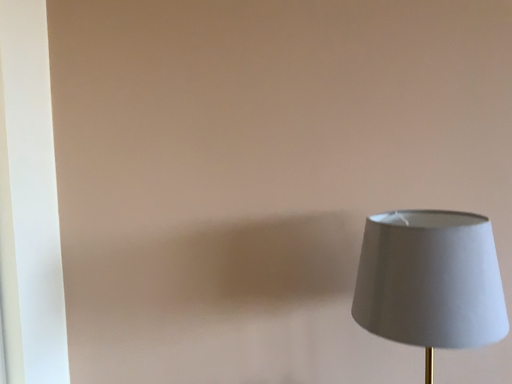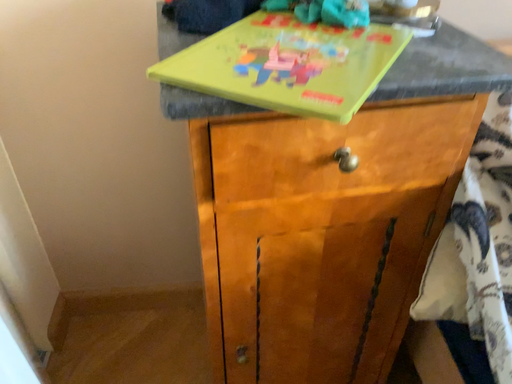
Question: How did the camera likely rotate when shooting the video?

Choices:
 (A) rotated upward
 (B) rotated downward

Answer: (B)